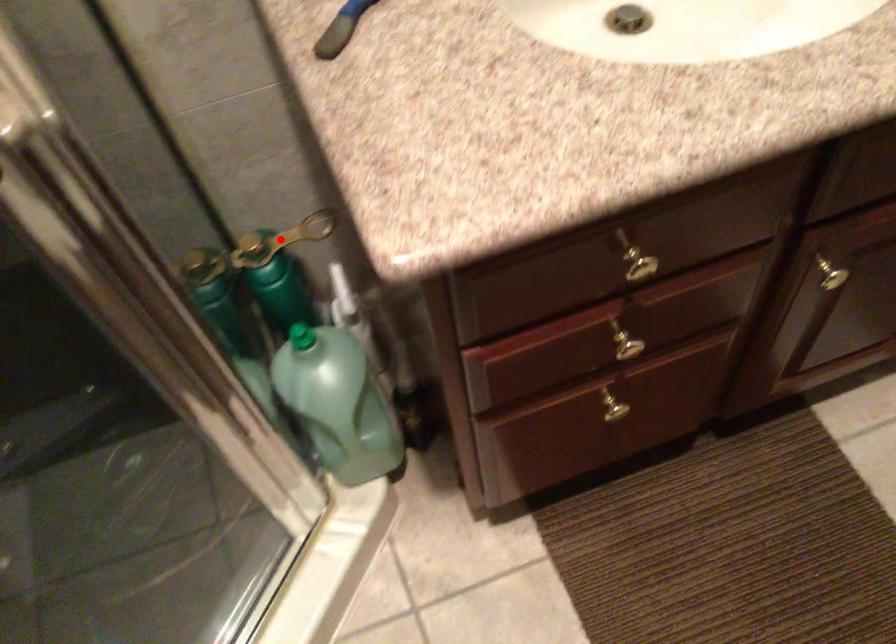
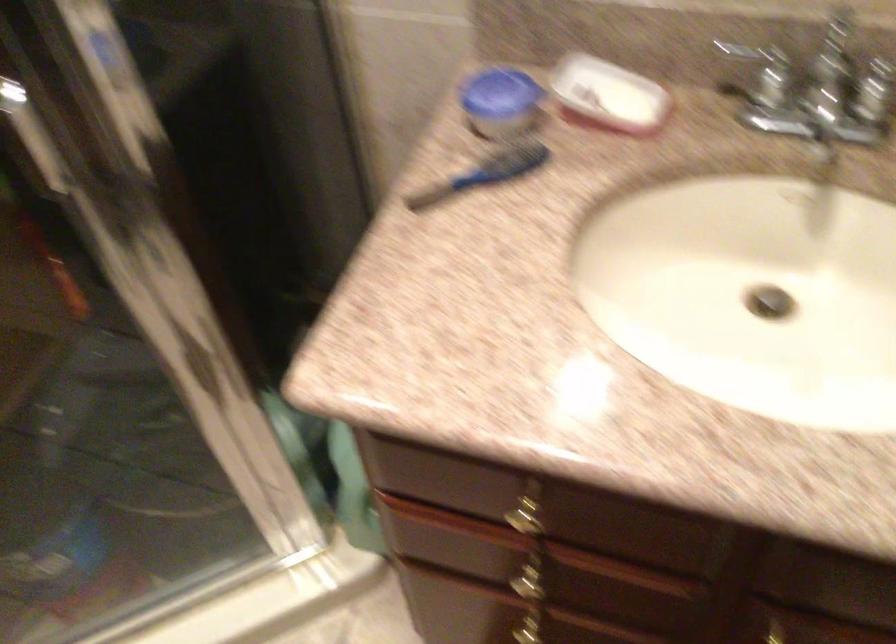
Question: I am providing you with two images of the same scene from different viewpoints. A red point is marked on the first image. Can you still see the location of the red point in image 2?

Choices:
 (A) Yes
 (B) No

Answer: (B)